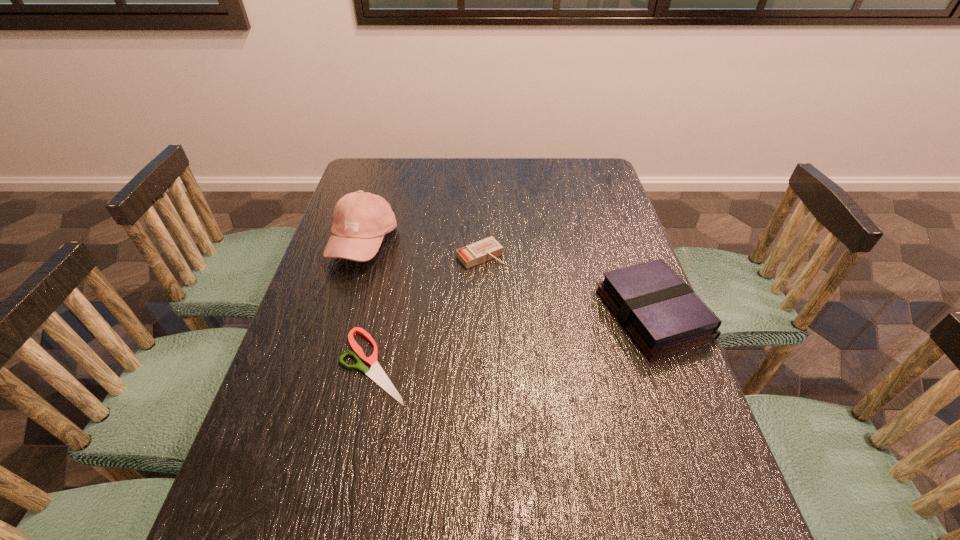
This screenshot has width=960, height=540. Find the location of `free space on the desktop that is between the shortest object and the book and is positioned on the front-facing side of the tallest object`. free space on the desktop that is between the shortest object and the book and is positioned on the front-facing side of the tallest object is located at coordinates (499, 342).

Find the location of a particular element. The width and height of the screenshot is (960, 540). vacant space on the desktop that is between the shortest object and the book and is positioned on the striking surface of the matchbox is located at coordinates (552, 333).